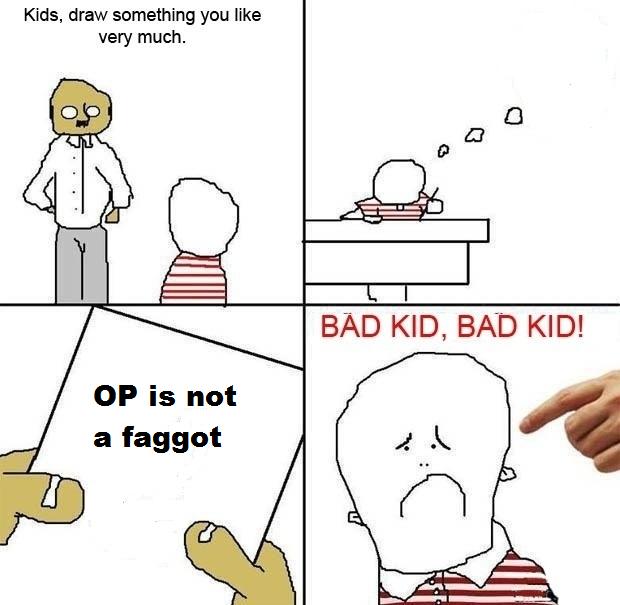
Where is `desk`? This screenshot has height=605, width=620. desk is located at coordinates (390, 264).